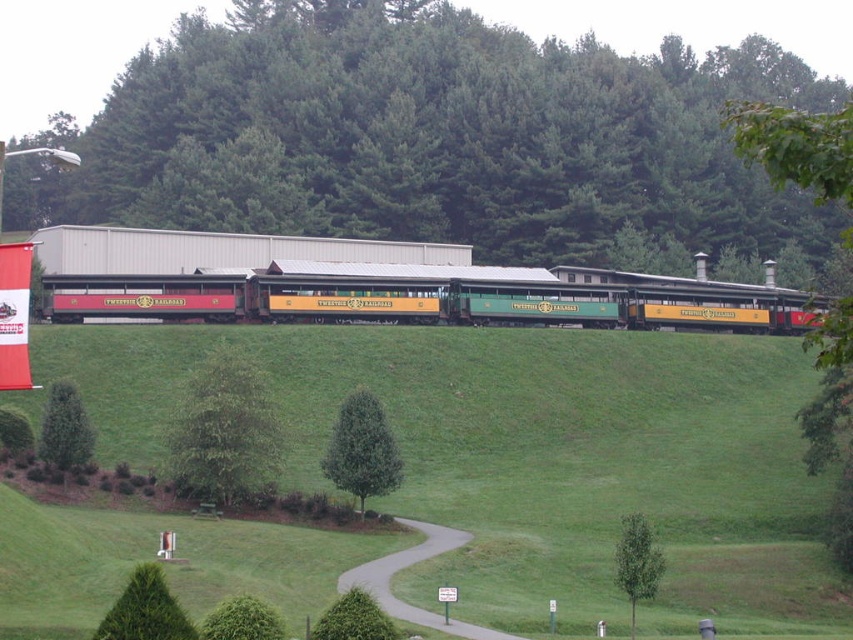
You are standing at the starting point of the paved path in the scenic outdoor setting. You want to reach the green matte tree at center. Which direction should you walk to get closer to it?

The green matte tree at center is located at point (363,449), so you should walk towards the center of the image to reach it.

You are standing at the center of the paved path between the green leafy tree at lower left and the green leafy tree at lower right. Which tree is closer to the top of the image?

The green leafy tree at lower left is located above the green leafy tree at lower right, so the green leafy tree at lower left is closer to the top of the image.

You are standing at the center of the winding paved path between the green leafy tree at lower left and the green leafy tree at lower right. Which tree has a wider spread of branches?

The green leafy tree at lower right has a wider spread of branches compared to the green leafy tree at lower left.